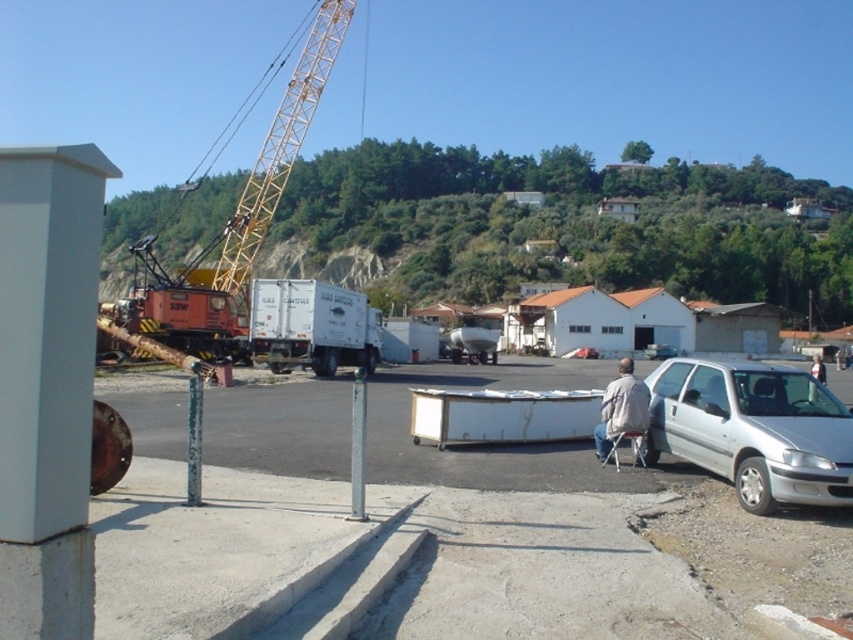
Question: Which point is farther from the camera taking this photo?

Choices:
 (A) (624, 384)
 (B) (252, 433)
 (C) (288, 115)
 (D) (838, 436)

Answer: (C)

Question: Does silver metallic car at lower right appear on the left side of orange metallic crane at left?

Choices:
 (A) no
 (B) yes

Answer: (A)

Question: Among these objects, which one is nearest to the camera?

Choices:
 (A) white matte trailer truck at center
 (B) orange metallic crane at left
 (C) white matte table at center

Answer: (C)

Question: Does white matte table at center appear on the left side of silver metallic car at lower right?

Choices:
 (A) yes
 (B) no

Answer: (B)

Question: Can you confirm if orange metallic crane at left is smaller than white matte trailer truck at center?

Choices:
 (A) no
 (B) yes

Answer: (A)

Question: Among these objects, which one is nearest to the camera?

Choices:
 (A) light gray fabric jacket at lower right
 (B) silver metallic car at lower right
 (C) white matte trailer truck at center

Answer: (B)